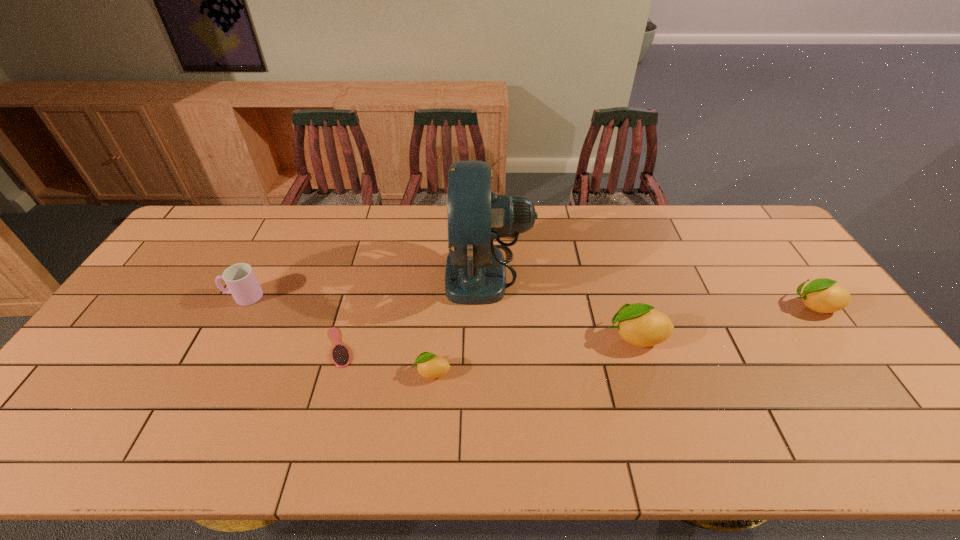
The image size is (960, 540). What are the coordinates of `free space located with leaves positioned above the fifth tallest object` in the screenshot? It's located at (299, 372).

You are a GUI agent. You are given a task and a screenshot of the screen. Output one action in this format:
    pyautogui.click(x=<x>, y=<y>)
    Task: Click on the free space located 0.110m with leaves positioned above the fifth tallest object
    The height and width of the screenshot is (540, 960).
    Given the screenshot: What is the action you would take?
    pyautogui.click(x=370, y=372)

What are the coordinates of `free space located 0.380m with leaves positioned above the fifth tallest object` in the screenshot? It's located at (263, 372).

Locate an element on the screen. vacant space located with leaves positioned above the second lemon from right to left is located at coordinates (578, 337).

Locate an element on the screen. vacant space located 0.400m with leaves positioned above the second lemon from right to left is located at coordinates (x=458, y=337).

Where is `vacant region located with leaves positioned above the second lemon from right to left`? Image resolution: width=960 pixels, height=540 pixels. vacant region located with leaves positioned above the second lemon from right to left is located at coordinates (538, 337).

Where is `free location located with leaves positioned above the farthest lemon`? free location located with leaves positioned above the farthest lemon is located at coordinates (658, 306).

Image resolution: width=960 pixels, height=540 pixels. I want to click on vacant space located with leaves positioned above the farthest lemon, so click(x=754, y=306).

Identify the location of vacant space positioned with leaves positioned above the farthest lemon. (706, 306).

In order to click on free space located with the handle on the side of the cup in this screenshot , I will do `click(190, 296)`.